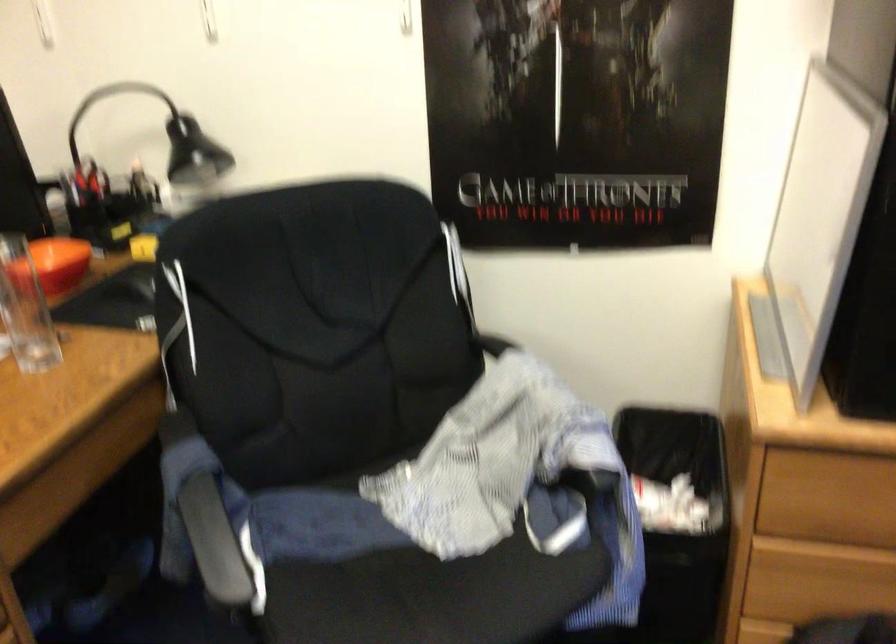
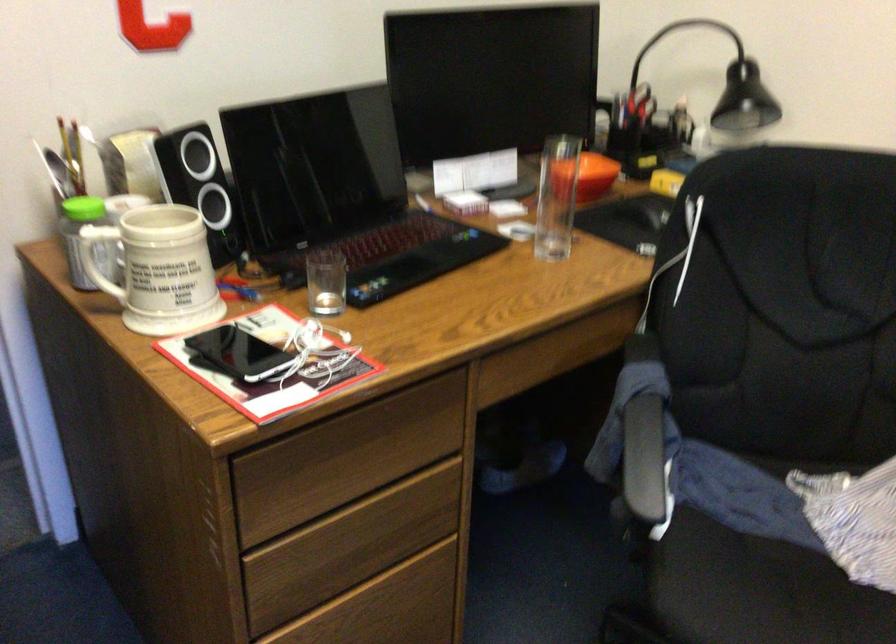
Where in the second image is the point corresponding to [214,525] from the first image?

(642, 442)